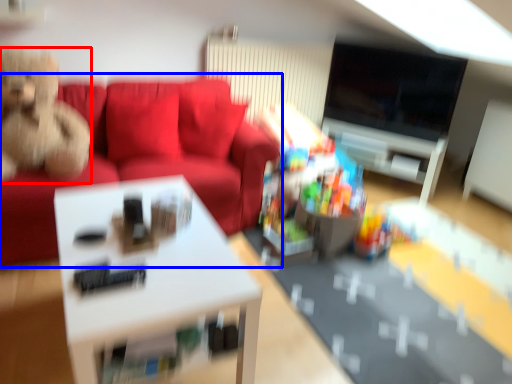
Question: Among these objects, which one is nearest to the camera, toy (highlighted by a red box) or studio couch (highlighted by a blue box)?

Choices:
 (A) toy
 (B) studio couch

Answer: (A)